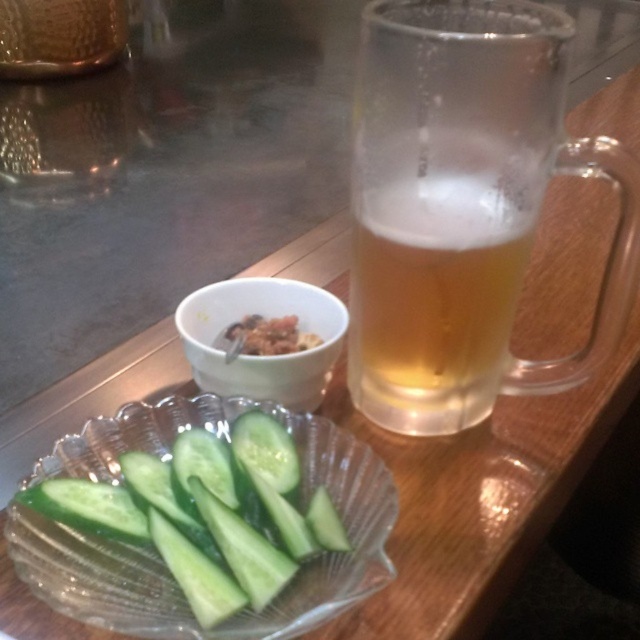
This screenshot has width=640, height=640. In order to click on frothy amber glass at upper right in this screenshot , I will do `click(465, 208)`.

Is frothy amber glass at upper right wider than green smooth cucumber at lower left?

Yes, frothy amber glass at upper right is wider than green smooth cucumber at lower left.

Which is in front, point (468, 410) or point (280, 449)?

Point (280, 449) is more forward.

What are the coordinates of `frothy amber glass at upper right` in the screenshot? It's located at (465, 208).

Does frothy amber glass at upper right lie behind savory crumbly snack at center?

No, it is in front of savory crumbly snack at center.

Does frothy amber glass at upper right appear on the left side of savory crumbly snack at center?

Incorrect, frothy amber glass at upper right is not on the left side of savory crumbly snack at center.

Locate an element on the screen. frothy amber glass at upper right is located at coordinates (465, 208).

Image resolution: width=640 pixels, height=640 pixels. What are the coordinates of `frothy amber glass at upper right` in the screenshot? It's located at (465, 208).

Who is positioned more to the left, green smooth cucumber at lower left or savory crumbly snack at center?

From the viewer's perspective, green smooth cucumber at lower left appears more on the left side.

Does point (288, 564) come closer to viewer compared to point (273, 333)?

Yes, point (288, 564) is in front of point (273, 333).

This screenshot has height=640, width=640. In order to click on green smooth cucumber at lower left in this screenshot , I will do `click(204, 512)`.